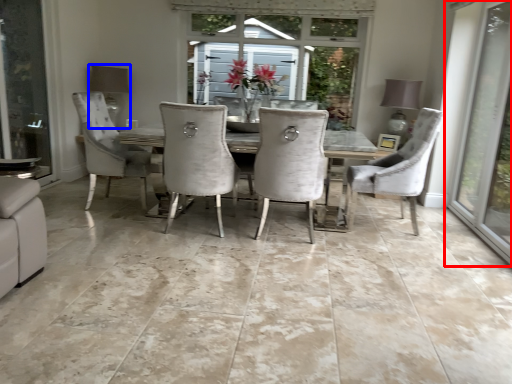
Question: Which of the following is the closest to the observer, window (highlighted by a red box) or lamp (highlighted by a blue box)?

Choices:
 (A) window
 (B) lamp

Answer: (A)